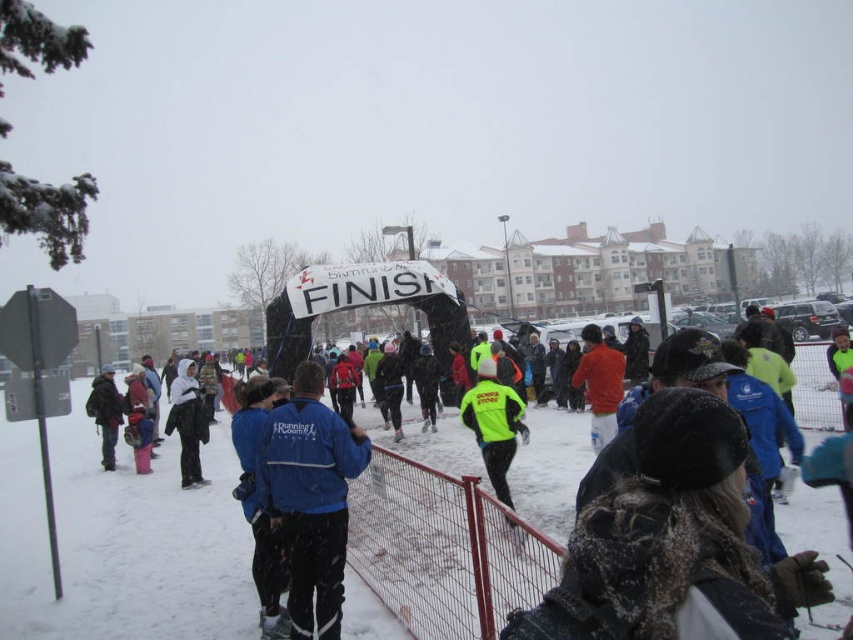
Does reflective blue jacket at center have a larger size compared to dark blue jacket at center?

No, reflective blue jacket at center is not bigger than dark blue jacket at center.

Consider the image. Is reflective blue jacket at center wider than dark blue jacket at center?

Incorrect, reflective blue jacket at center's width does not surpass dark blue jacket at center's.

You are a GUI agent. You are given a task and a screenshot of the screen. Output one action in this format:
    pyautogui.click(x=<x>, y=<y>)
    Task: Click on the reflective blue jacket at center
    The image size is (853, 640).
    Given the screenshot: What is the action you would take?
    pyautogui.click(x=550, y=467)

Is blue fleece jacket at center to the left of dark blue jacket at center from the viewer's perspective?

Incorrect, blue fleece jacket at center is not on the left side of dark blue jacket at center.

Between blue fleece jacket at center and dark blue jacket at center, which one is positioned lower?

dark blue jacket at center

Who is more distant from viewer, [339,566] or [88,401]?

Positioned behind is point [88,401].

Locate an element on the screen. The height and width of the screenshot is (640, 853). blue fleece jacket at center is located at coordinates (310, 499).

Can you confirm if neon yellow jacket at center is positioned above white fleece jacket at center?

Yes, neon yellow jacket at center is above white fleece jacket at center.

Can you confirm if neon yellow jacket at center is positioned below white fleece jacket at center?

Incorrect, neon yellow jacket at center is not positioned below white fleece jacket at center.

I want to click on neon yellow jacket at center, so click(492, 424).